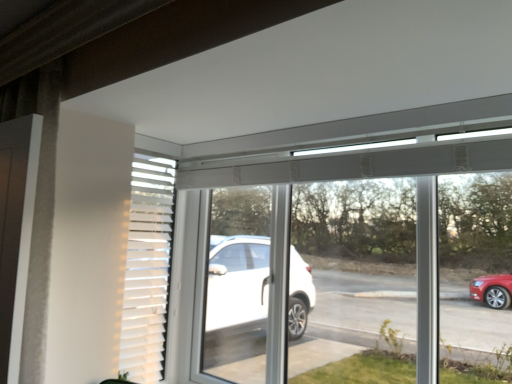
Question: From the image's perspective, is white matte shutter at upper center located above or below transparent glass window at center?

Choices:
 (A) above
 (B) below

Answer: (A)

Question: Based on their positions, is white matte shutter at upper center located to the left or right of transparent glass window at center?

Choices:
 (A) left
 (B) right

Answer: (A)

Question: Considering the positions of white matte shutter at upper center and transparent glass window at center in the image, is white matte shutter at upper center taller or shorter than transparent glass window at center?

Choices:
 (A) tall
 (B) short

Answer: (B)

Question: Based on their positions, is transparent glass window at center located to the left or right of white matte shutter at upper center?

Choices:
 (A) right
 (B) left

Answer: (A)

Question: Considering the positions of point (431, 236) and point (166, 266), is point (431, 236) closer or farther from the camera than point (166, 266)?

Choices:
 (A) farther
 (B) closer

Answer: (B)

Question: From a real-world perspective, is transparent glass window at center physically located above or below white matte shutter at upper center?

Choices:
 (A) below
 (B) above

Answer: (A)

Question: Relative to white matte shutter at upper center, is transparent glass window at center in front or behind?

Choices:
 (A) front
 (B) behind

Answer: (A)